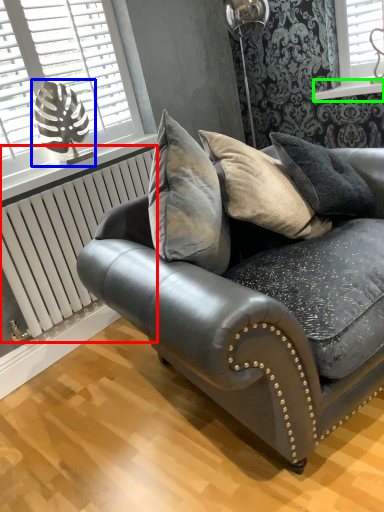
Question: Based on their relative distances, which object is farther from radiator (highlighted by a red box)? Choose from table lamp (highlighted by a blue box) and window sill (highlighted by a green box).

Choices:
 (A) table lamp
 (B) window sill

Answer: (B)